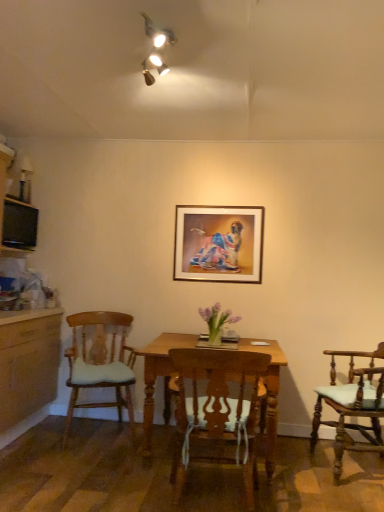
Identify the location of free point above gold-framed picture at center (from a real-world perspective). (225, 201).